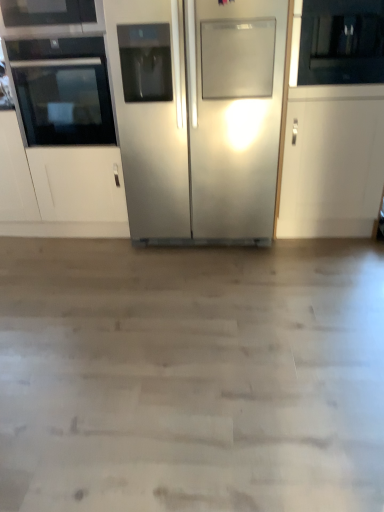
Question: Is the depth of black glass oven at left less than that of stainless steel refrigerator at center?

Choices:
 (A) yes
 (B) no

Answer: (B)

Question: Is black glass oven at left touching stainless steel refrigerator at center?

Choices:
 (A) yes
 (B) no

Answer: (B)

Question: Does black glass oven at left appear on the left side of stainless steel refrigerator at center?

Choices:
 (A) yes
 (B) no

Answer: (A)

Question: From a real-world perspective, is black glass oven at left on top of stainless steel refrigerator at center?

Choices:
 (A) yes
 (B) no

Answer: (A)

Question: Is black glass oven at left further to camera compared to stainless steel refrigerator at center?

Choices:
 (A) no
 (B) yes

Answer: (B)

Question: Considering the relative positions of black glass oven at left and stainless steel refrigerator at center in the image provided, is black glass oven at left to the right of stainless steel refrigerator at center from the viewer's perspective?

Choices:
 (A) no
 (B) yes

Answer: (A)

Question: Considering the relative positions of stainless steel refrigerator at center and black glass oven at left in the image provided, is stainless steel refrigerator at center behind black glass oven at left?

Choices:
 (A) yes
 (B) no

Answer: (B)

Question: Is stainless steel refrigerator at center oriented towards black glass oven at left?

Choices:
 (A) no
 (B) yes

Answer: (A)

Question: Considering the relative sizes of stainless steel refrigerator at center and black glass oven at left in the image provided, is stainless steel refrigerator at center shorter than black glass oven at left?

Choices:
 (A) no
 (B) yes

Answer: (A)

Question: Would you say stainless steel refrigerator at center is a long distance from black glass oven at left?

Choices:
 (A) no
 (B) yes

Answer: (A)

Question: Is stainless steel refrigerator at center completely or partially outside of black glass oven at left?

Choices:
 (A) no
 (B) yes

Answer: (B)

Question: Is stainless steel refrigerator at center oriented away from black glass oven at left?

Choices:
 (A) yes
 (B) no

Answer: (B)

Question: Looking at their shapes, would you say black glass oven at left is wider or thinner than stainless steel refrigerator at center?

Choices:
 (A) wide
 (B) thin

Answer: (B)